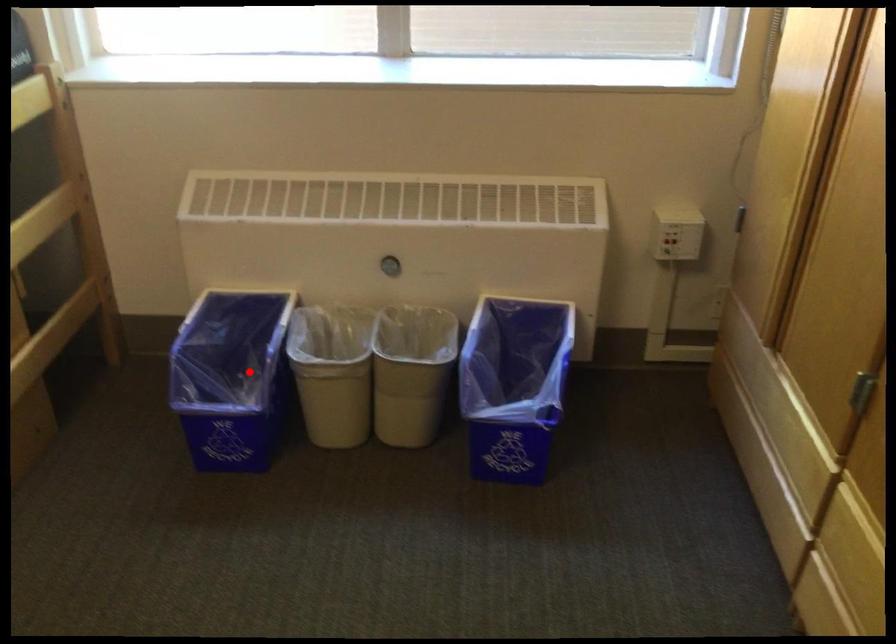
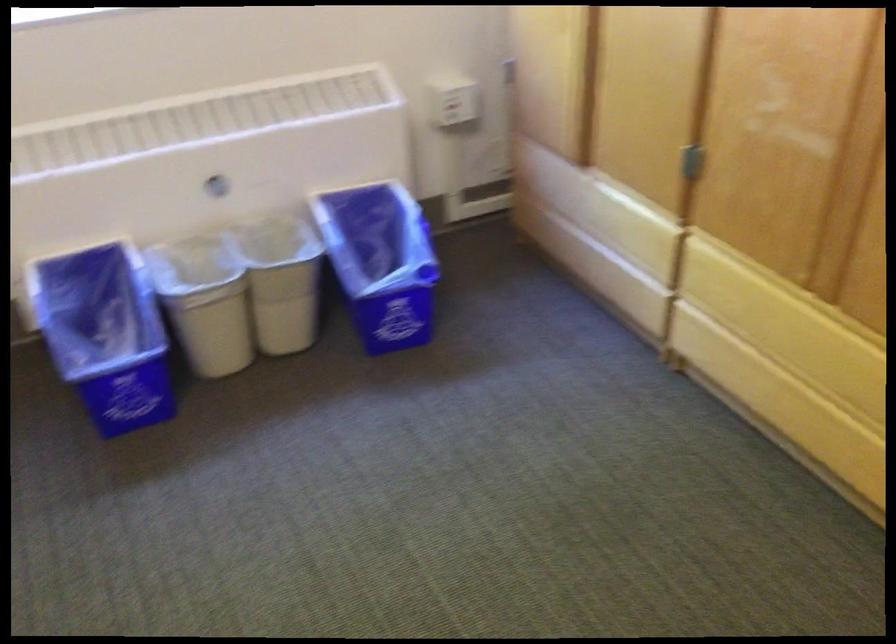
The point at the highlighted location is marked in the first image. Where is the corresponding point in the second image?

(105, 334)